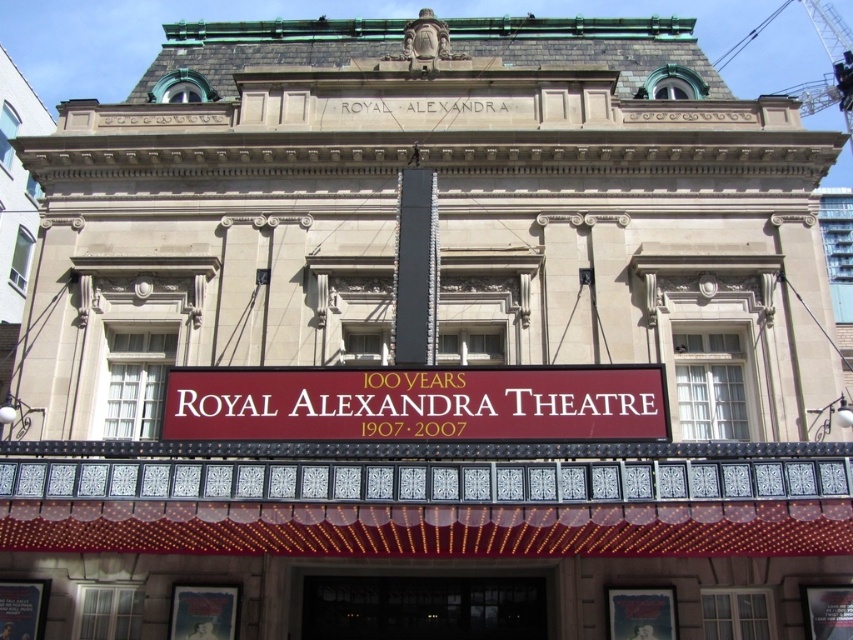
Can you confirm if maroon sign at center is positioned to the right of black glass door at center?

Incorrect, maroon sign at center is not on the right side of black glass door at center.

Looking at this image, measure the distance between maroon sign at center and black glass door at center.

47.11 feet

Describe the element at coordinates (416, 403) in the screenshot. I see `maroon sign at center` at that location.

You are a GUI agent. You are given a task and a screenshot of the screen. Output one action in this format:
    pyautogui.click(x=<x>, y=<y>)
    Task: Click on the maroon sign at center
    The width and height of the screenshot is (853, 640).
    Given the screenshot: What is the action you would take?
    416,403